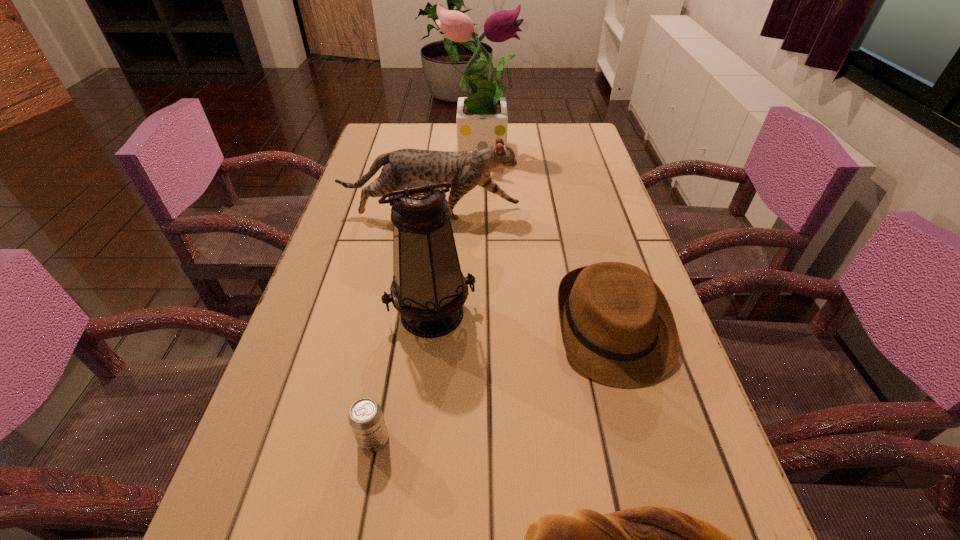
Identify the location of the farthest object. (482, 117).

I want to click on flower arrangement, so click(482, 117).

Image resolution: width=960 pixels, height=540 pixels. In order to click on oil lamp in this screenshot , I will do `click(429, 290)`.

Find the location of a particular element. This screenshot has width=960, height=540. the fourth shortest object is located at coordinates (465, 170).

The width and height of the screenshot is (960, 540). In order to click on cat in this screenshot , I will do `click(465, 170)`.

Identify the location of fedora. [x=617, y=327].

Locate an element on the screen. the second nearest object is located at coordinates (365, 417).

Find the location of `free space located on the front-facing side of the flower arrangement`. free space located on the front-facing side of the flower arrangement is located at coordinates (575, 150).

Find the location of a particular element. This screenshot has width=960, height=540. vacant space located on the front of the oil lamp is located at coordinates (419, 443).

The height and width of the screenshot is (540, 960). What are the coordinates of `vacant position located 0.230m on the face of the cat` in the screenshot? It's located at (608, 213).